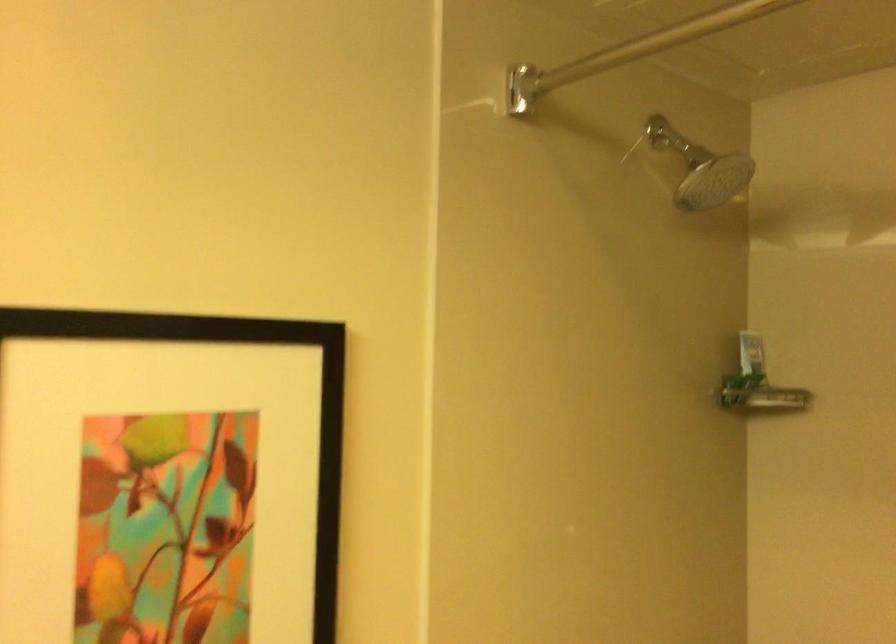
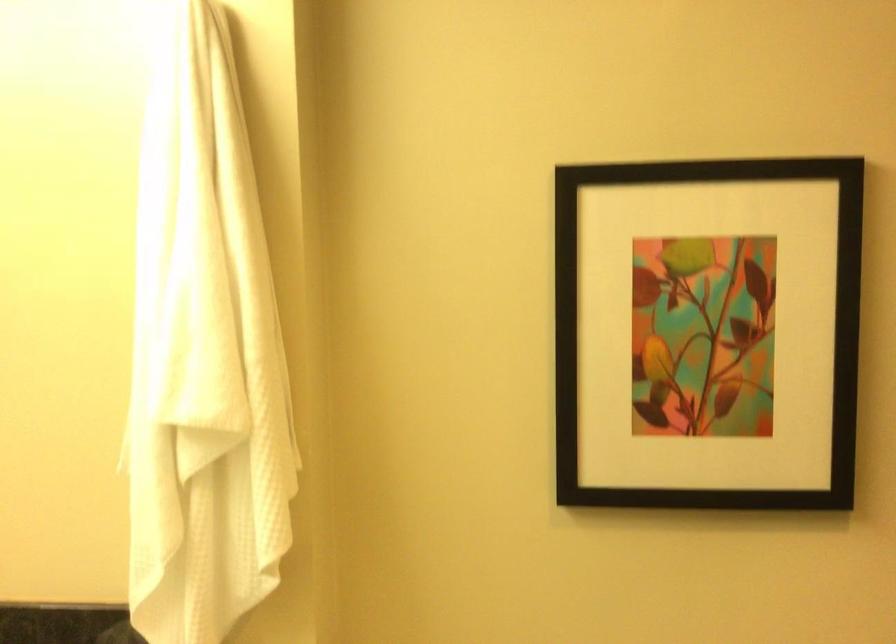
Find the pixel in the second image that matches the point at 177,538 in the first image.

(708, 333)